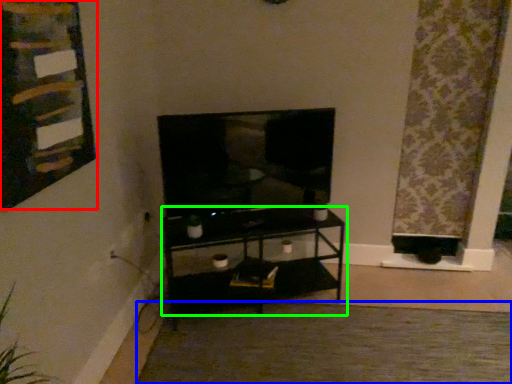
Question: Which object is positioned farthest from bulletin board (highlighted by a red box)? Select from plain (highlighted by a blue box) and shelf (highlighted by a green box).

Choices:
 (A) plain
 (B) shelf

Answer: (A)